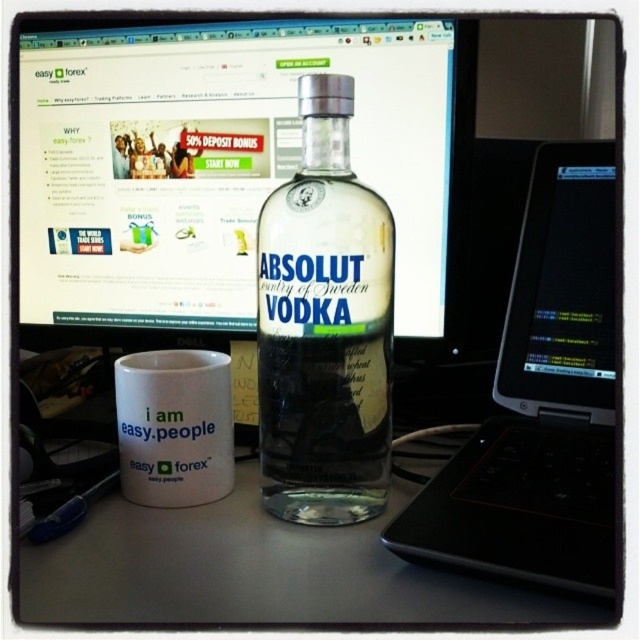
You are setting up a desk and want to place a new keyboard that is 15 cm wide. You have space between the transparent glass monitor at center and the clear glass bottle at center. Can the keyboard fit in that space?

The transparent glass monitor at center is wider than the clear glass bottle at center. Therefore, the space between them may be sufficient for the keyboard, but since the exact distance isn

You are setting up a new monitor on your desk. You want to place it exactly where the transparent glass monitor at center is located. What are the coordinates of the spot where you should place the new monitor?

The coordinates for placing the new monitor should be at point (228, 163), as that is where the transparent glass monitor at center is positioned.